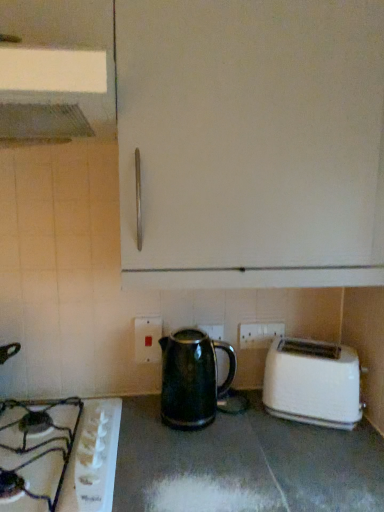
Question: Is green glossy kettle at center wider or thinner than black glossy kettle at center?

Choices:
 (A) wide
 (B) thin

Answer: (B)

Question: From a real-world perspective, is green glossy kettle at center physically located above or below black glossy kettle at center?

Choices:
 (A) below
 (B) above

Answer: (B)

Question: Estimate the real-world distances between objects in this image. Which object is closer to the metallic silver exhaust hood at upper left?

Choices:
 (A) black ceramic gas stove at lower left
 (B) white plastic toaster at lower right
 (C) green glossy kettle at center
 (D) white plastic electrical outlet at center, acting as the first electric outlet starting from the back
 (E) white plastic electric outlet at lower center, placed as the 1th electric outlet when sorted from front to back

Answer: (E)

Question: Considering the real-world distances, which object is farthest from the white plastic electrical outlet at center, acting as the first electric outlet starting from the back?

Choices:
 (A) white plastic electric outlet at lower center, placed as the 1th electric outlet when sorted from front to back
 (B) white plastic toaster at lower right
 (C) metallic silver exhaust hood at upper left
 (D) black glossy kettle at center
 (E) black ceramic gas stove at lower left

Answer: (C)